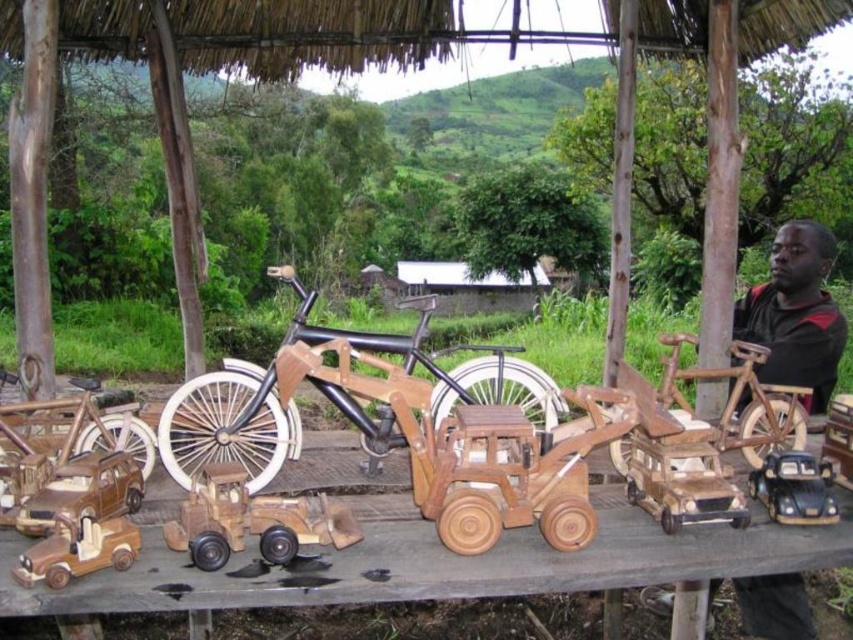
Is wooden toy car at lower left bigger than wooden matte truck at lower left?

Yes.

Describe the element at coordinates (83, 492) in the screenshot. This screenshot has width=853, height=640. I see `wooden toy car at lower left` at that location.

Which is behind, point (74, 477) or point (86, 524)?

Positioned behind is point (74, 477).

Image resolution: width=853 pixels, height=640 pixels. I want to click on wooden toy car at lower left, so click(x=83, y=492).

Can you confirm if wooden tractor at center is positioned above wooden matte truck at lower left?

Yes, wooden tractor at center is above wooden matte truck at lower left.

Is wooden tractor at center behind wooden matte truck at lower left?

Yes.

Locate an element on the screen. This screenshot has height=640, width=853. wooden tractor at center is located at coordinates (509, 468).

Can you confirm if wooden toy car at lower left is positioned to the right of shiny black car at lower right?

Incorrect, wooden toy car at lower left is not on the right side of shiny black car at lower right.

The height and width of the screenshot is (640, 853). I want to click on wooden toy car at lower left, so click(83, 492).